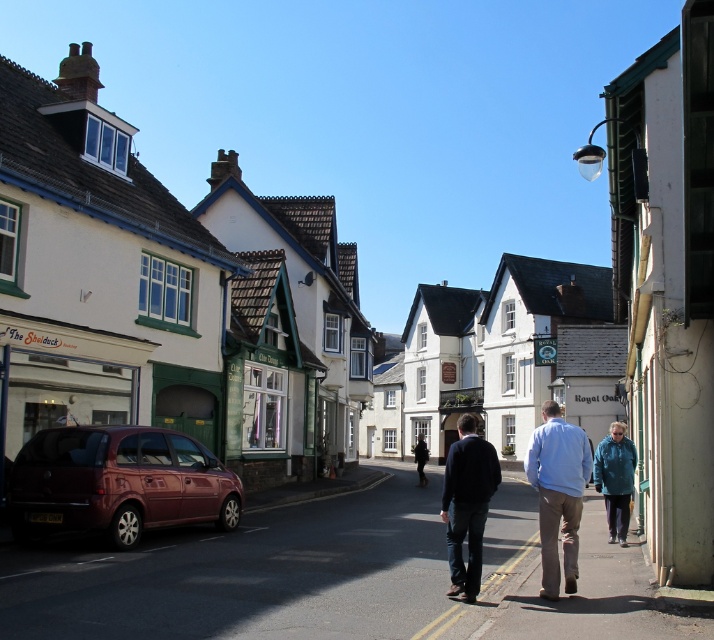
Which is above, blue fabric jacket at center or dark blue sweater at center?

blue fabric jacket at center is higher up.

Does blue fabric jacket at center have a lesser height compared to dark blue sweater at center?

Correct, blue fabric jacket at center is not as tall as dark blue sweater at center.

Where is `blue fabric jacket at center`? blue fabric jacket at center is located at coordinates (558, 492).

Identify the location of blue fabric jacket at center. (558, 492).

Does metallic car at lower left appear under blue fabric jacket at center?

Yes, metallic car at lower left is below blue fabric jacket at center.

Which is above, metallic car at lower left or blue fabric jacket at center?

blue fabric jacket at center is above.

Is point (169, 632) behind point (565, 544)?

No, (169, 632) is closer to viewer.

You are a GUI agent. You are given a task and a screenshot of the screen. Output one action in this format:
    pyautogui.click(x=<x>, y=<y>)
    Task: Click on the metallic car at lower left
    This screenshot has height=640, width=714.
    Given the screenshot: What is the action you would take?
    pyautogui.click(x=331, y=577)

Does metallic car at lower left appear on the left side of shiny maroon hatchback at lower left?

No, metallic car at lower left is not to the left of shiny maroon hatchback at lower left.

Who is positioned more to the left, metallic car at lower left or shiny maroon hatchback at lower left?

Positioned to the left is shiny maroon hatchback at lower left.

Locate an element on the screen. metallic car at lower left is located at coordinates coord(331,577).